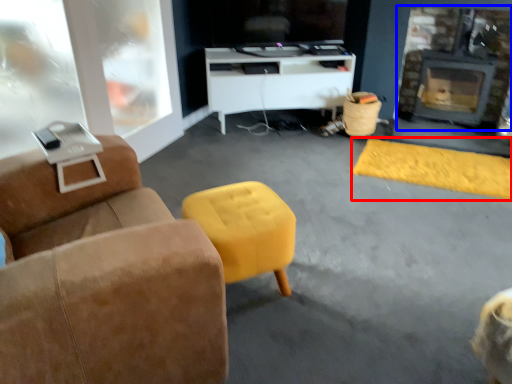
Question: Which object is further to the camera taking this photo, flat (highlighted by a red box) or fireplace (highlighted by a blue box)?

Choices:
 (A) flat
 (B) fireplace

Answer: (B)